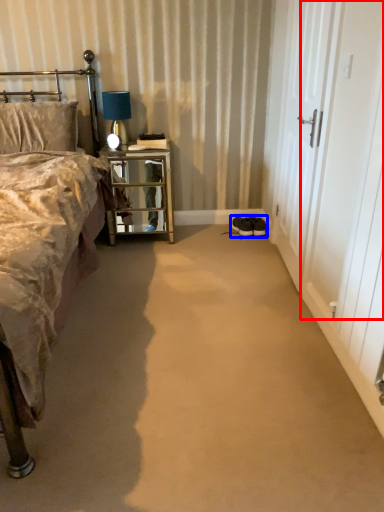
Question: Which of the following is the farthest to the observer, screen door (highlighted by a red box) or footwear (highlighted by a blue box)?

Choices:
 (A) screen door
 (B) footwear

Answer: (B)